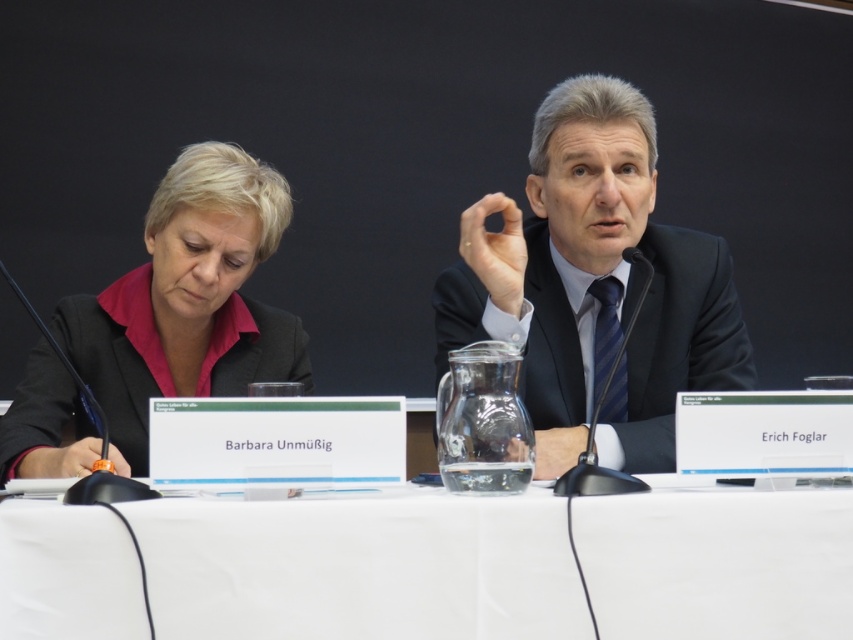
Question: Which is nearer to the dark blue suit at center?

Choices:
 (A) white fabric table at center
 (B) matte black jacket at left

Answer: (A)

Question: Which object is positioned farthest from the matte black jacket at left?

Choices:
 (A) dark blue suit at center
 (B) white fabric table at center

Answer: (B)

Question: Which object is closer to the camera taking this photo?

Choices:
 (A) matte black jacket at left
 (B) dark blue suit at center

Answer: (A)

Question: From the image, what is the correct spatial relationship of white fabric table at center in relation to dark blue suit at center?

Choices:
 (A) right
 (B) left

Answer: (B)

Question: Is white fabric table at center closer to the viewer compared to dark blue suit at center?

Choices:
 (A) yes
 (B) no

Answer: (A)

Question: Is white fabric table at center thinner than dark blue suit at center?

Choices:
 (A) yes
 (B) no

Answer: (B)